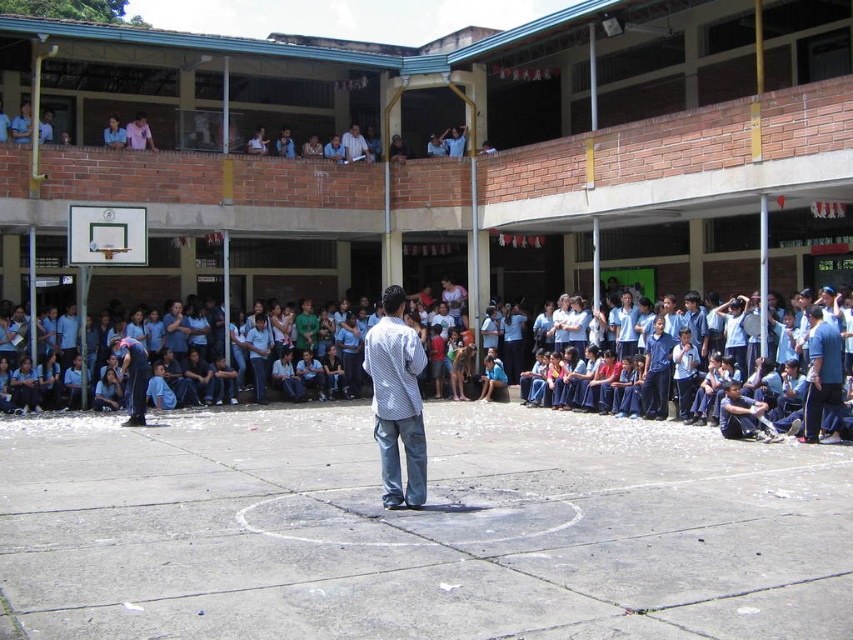
Question: Is the position of concrete basketball court at center more distant than that of white striped shirt at center?

Choices:
 (A) no
 (B) yes

Answer: (A)

Question: Among these points, which one is farthest from the camera?

Choices:
 (A) pos(206,509)
 (B) pos(815,388)
 (C) pos(416,461)
 (D) pos(735,400)

Answer: (D)

Question: Which point is closer to the camera?

Choices:
 (A) blue uniform at center
 (B) blue uniform at right
 (C) white striped shirt at center
 (D) concrete basketball court at center

Answer: (D)

Question: Can you confirm if concrete basketball court at center is wider than white striped shirt at center?

Choices:
 (A) yes
 (B) no

Answer: (A)

Question: Among these objects, which one is farthest from the camera?

Choices:
 (A) white checkered shirt at center
 (B) blue uniform at right
 (C) blue uniform at center
 (D) concrete basketball court at center

Answer: (B)

Question: Can you confirm if blue uniform at center is positioned to the left of white checkered shirt at center?

Choices:
 (A) no
 (B) yes

Answer: (B)